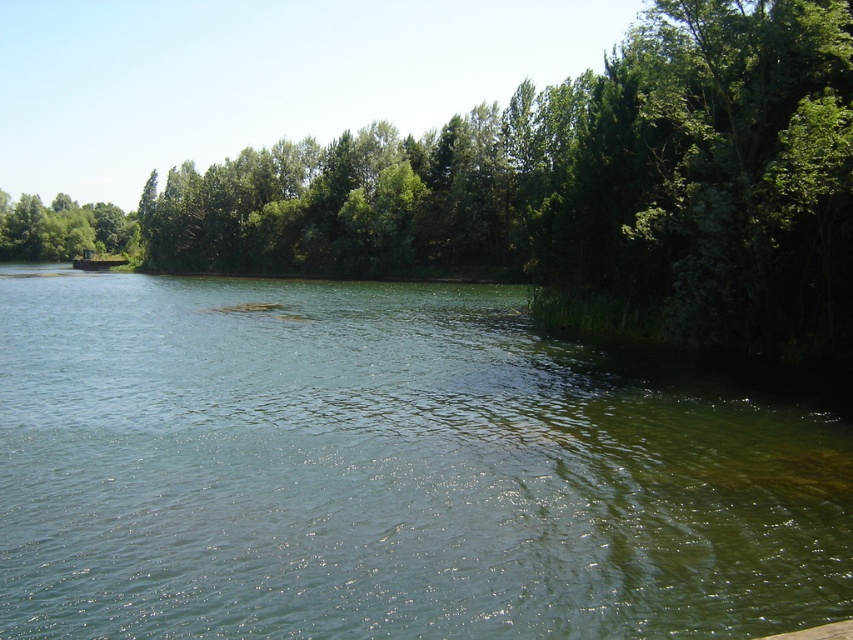
Who is positioned more to the right, green translucent water at center or green leafy tree at left?

green translucent water at center

Is green translucent water at center to the right of green leafy tree at left from the viewer's perspective?

Indeed, green translucent water at center is positioned on the right side of green leafy tree at left.

The height and width of the screenshot is (640, 853). In order to click on green translucent water at center in this screenshot , I will do `click(386, 472)`.

The width and height of the screenshot is (853, 640). What do you see at coordinates (386, 472) in the screenshot?
I see `green translucent water at center` at bounding box center [386, 472].

Between green translucent water at center and green leafy tree at center, which one has less height?

With less height is green translucent water at center.

What do you see at coordinates (386, 472) in the screenshot? The width and height of the screenshot is (853, 640). I see `green translucent water at center` at bounding box center [386, 472].

This screenshot has width=853, height=640. Find the location of `green translucent water at center`. green translucent water at center is located at coordinates (386, 472).

Which of these two, green leafy tree at left or brown wooden dock at left, stands shorter?

brown wooden dock at left

Is green leafy tree at left positioned in front of brown wooden dock at left?

No, it is not.

Between point (103, 237) and point (74, 262), which one is positioned in front?

Point (74, 262) is in front.

Find the location of a particular element. The width and height of the screenshot is (853, 640). green leafy tree at left is located at coordinates (62, 228).